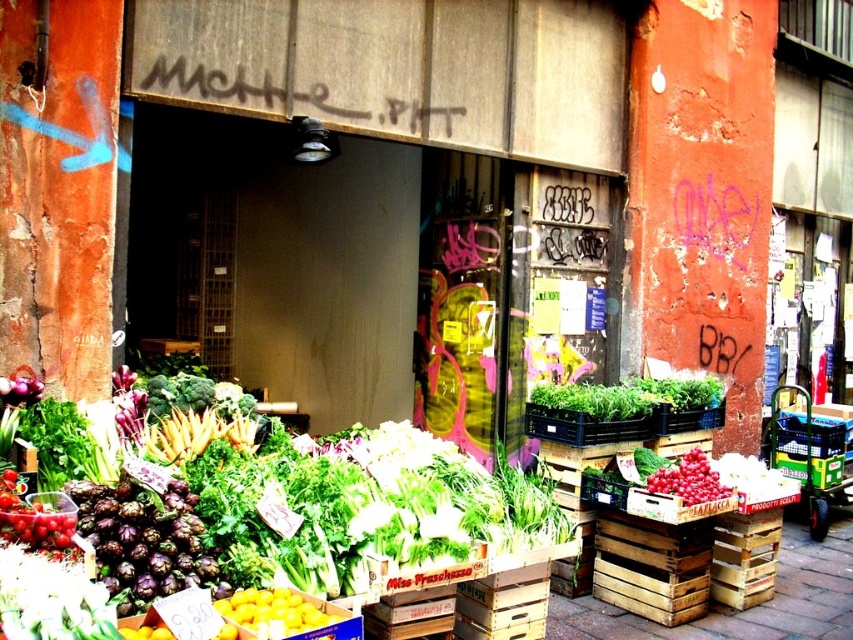
You are standing at the entrance of the market and see the point marked at coordinate (274, 611). What object is this point located on?

The point marked at coordinate (274, 611) is located on the yellow matte lemons at center.